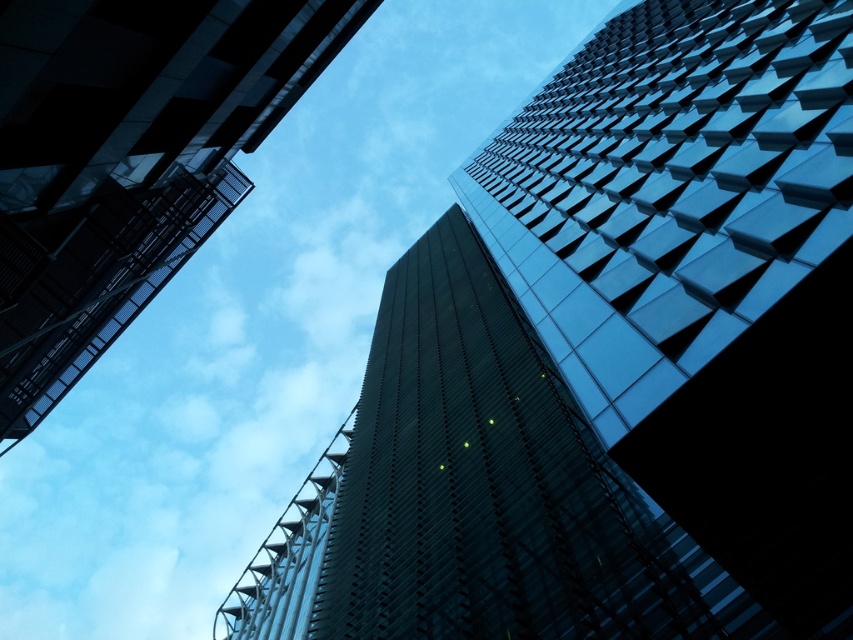
Based on the photo, you are standing at the base of the glassy reflective skyscraper at center. You want to take a photo of the entire building without any obstructions. Considering the distance between you and the building, what is the minimum focal length lens you need to use to capture the entire structure in one frame?

To capture the entire glassy reflective skyscraper at center without obstructions from a distance of 40.43 feet, the minimum focal length required would depend on the camera sensor size and the building height. However, since the question specifies using the given distance, a lens with a focal length of approximately 35mm to 50mm on a full frame camera would typically suffice for such a scenario.

You are a window cleaner with a 10 meter long ladder. You need to clean both the glassy reflective skyscraper at center and the glassy reflective skyscraper at upper left. Can you safely reach both buildings with your ladder?

The distance between the glassy reflective skyscraper at center and the glassy reflective skyscraper at upper left is 12.79 meters. Since your ladder is only 10 meters long, it is not long enough to safely reach both buildings.

You are a drone operator planning to fly a drone between the two glassy reflective skyscrapers mentioned. Given that the glassy reflective skyscraper at center and the glassy reflective skyscraper at upper left have different heights, which one should you avoid flying near to prevent collision?

You should avoid flying near the glassy reflective skyscraper at center because it is taller than the glassy reflective skyscraper at upper left, posing a higher risk of collision.